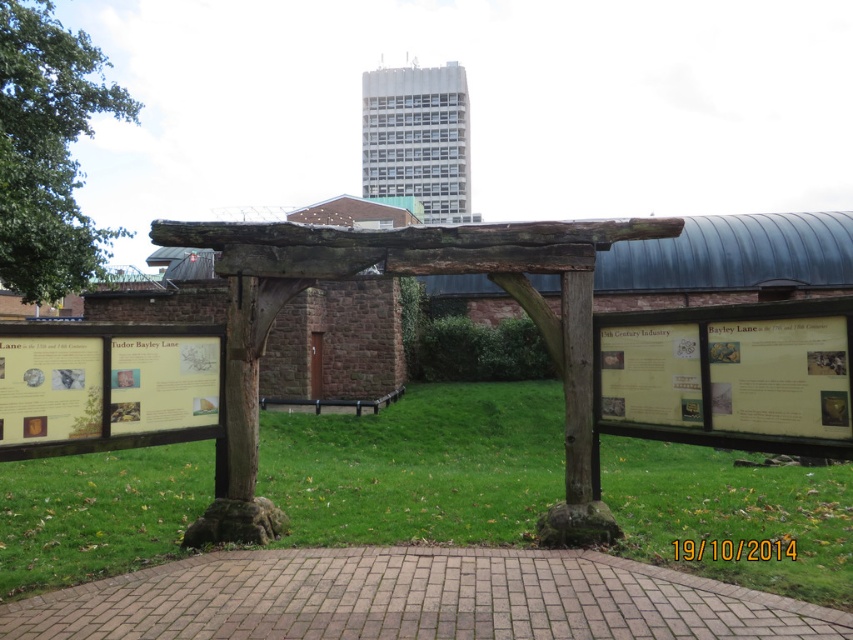
Question: Which object appears farthest from the camera in this image?

Choices:
 (A) brown wooden pergola at upper center
 (B) weathered wood arch at center
 (C) brick paved path at center

Answer: (A)

Question: Is weathered wood arch at center further to camera compared to brown wooden pergola at upper center?

Choices:
 (A) yes
 (B) no

Answer: (B)

Question: Does brick paved path at center have a greater width compared to brown wooden pergola at upper center?

Choices:
 (A) no
 (B) yes

Answer: (A)

Question: Among these points, which one is farthest from the camera?

Choices:
 (A) (462, 144)
 (B) (294, 260)

Answer: (A)

Question: Which point is farther from the camera taking this photo?

Choices:
 (A) (572, 557)
 (B) (453, 96)
 (C) (258, 266)

Answer: (B)

Question: Can you confirm if brick paved path at center is positioned to the right of brown wooden pergola at upper center?

Choices:
 (A) yes
 (B) no

Answer: (A)